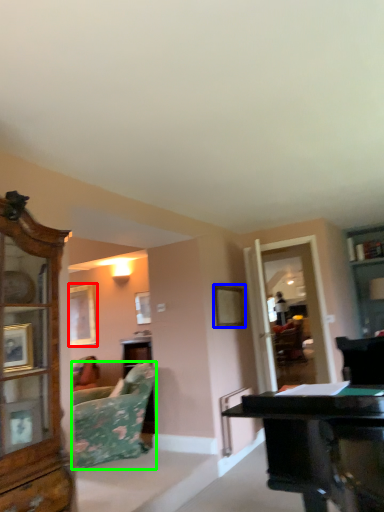
Question: Estimate the real-world distances between objects in this image. Which object is closer to picture frame (highlighted by a red box), picture frame (highlighted by a blue box) or studio couch (highlighted by a green box)?

Choices:
 (A) picture frame
 (B) studio couch

Answer: (B)